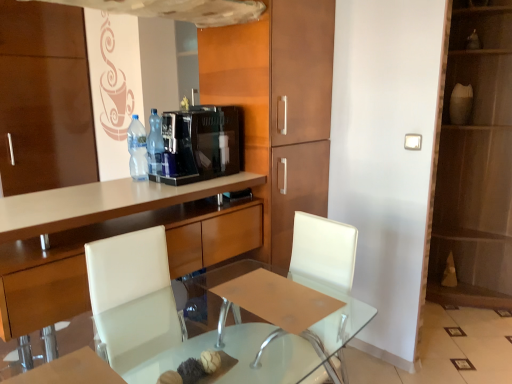
At what (x,y) coordinates should I click in order to perform the action: click on free space in front of clear plastic bottle at center, which is the second bottle from right to left. Please return your answer as a coordinate pair (x, y). This screenshot has width=512, height=384. Looking at the image, I should click on (131, 183).